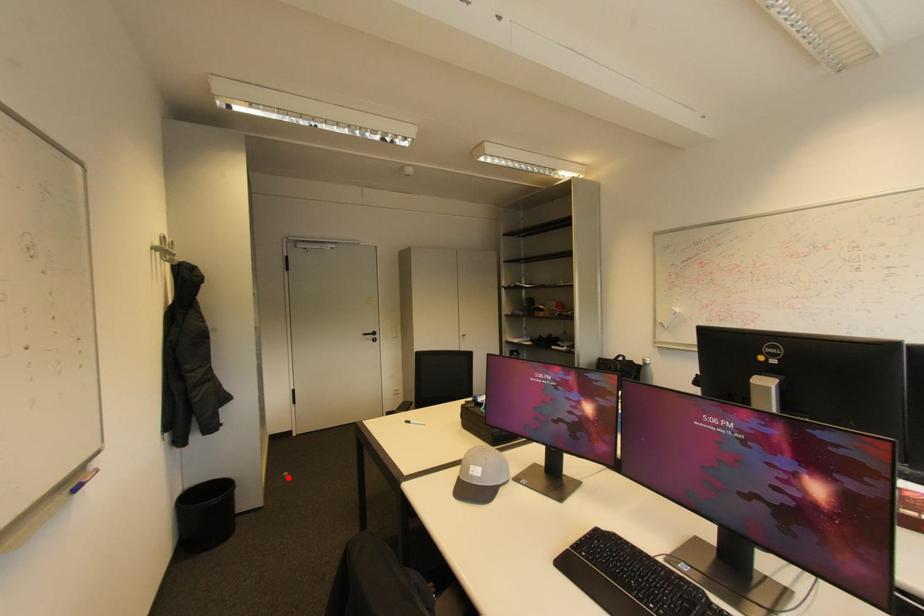
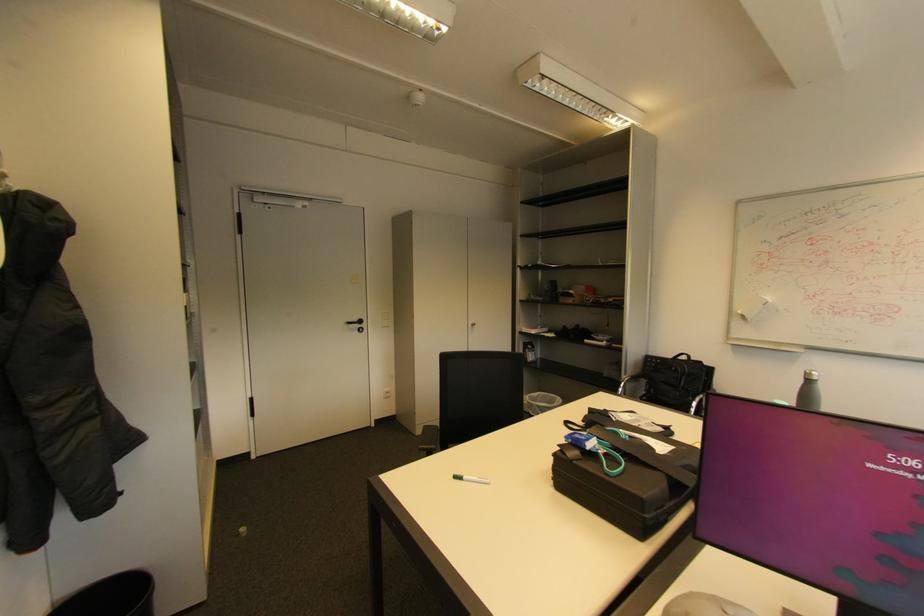
The point at the highlighted location is marked in the first image. Where is the corresponding point in the second image?

(244, 535)